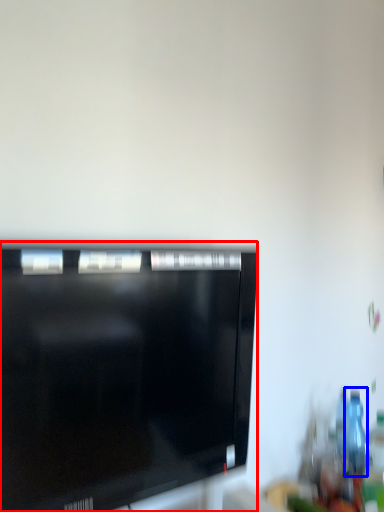
Question: Which object appears closest to the camera in this image, television (highlighted by a red box) or bottle (highlighted by a blue box)?

Choices:
 (A) television
 (B) bottle

Answer: (A)